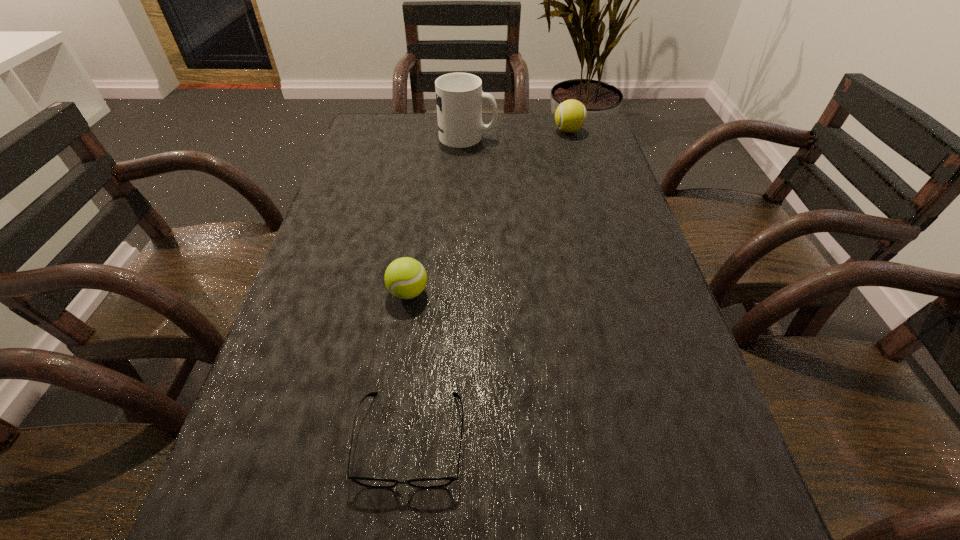
Identify the location of vacant region located 0.050m on the front-facing side of the nearest object. (399, 533).

Where is `mug that is at the far edge`? The image size is (960, 540). mug that is at the far edge is located at coordinates (459, 96).

Find the location of a particular element. The image size is (960, 540). tennis ball situated at the far edge is located at coordinates (570, 116).

Identify the location of object that is at the right edge. (570, 116).

Identify the location of object situated at the far right corner. This screenshot has height=540, width=960. (570, 116).

You are a GUI agent. You are given a task and a screenshot of the screen. Output one action in this format:
    pyautogui.click(x=<x>, y=<y>)
    Task: Click on the free space at the far edge
    The height and width of the screenshot is (540, 960).
    Given the screenshot: What is the action you would take?
    pyautogui.click(x=420, y=135)

What are the coordinates of `vacant space at the left edge of the desktop` in the screenshot? It's located at (286, 473).

Find the location of a particular element. The height and width of the screenshot is (540, 960). vacant position at the right edge of the desktop is located at coordinates (632, 362).

Identify the location of vacant space at the far right corner. (596, 143).

Locate an element on the screen. The image size is (960, 540). free space between the nearer tennis ball and the farther tennis ball is located at coordinates (489, 212).